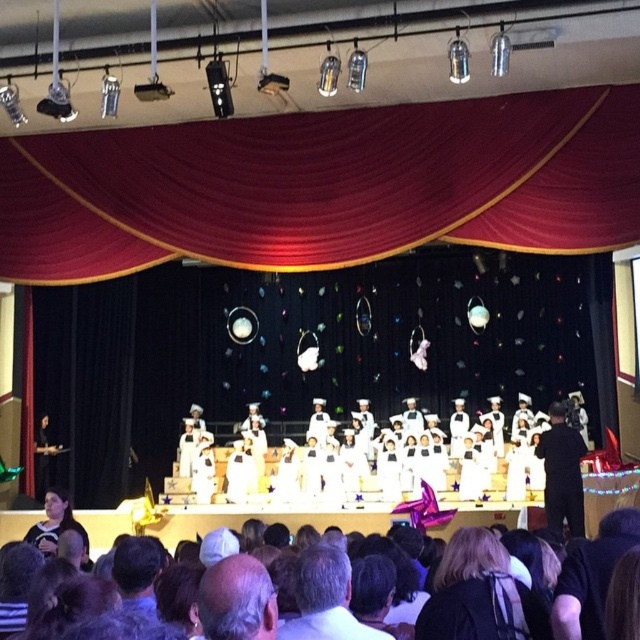
Question: Can you confirm if velvet red curtain at upper center is positioned to the left of white matte uniform at center?

Choices:
 (A) yes
 (B) no

Answer: (A)

Question: Can you confirm if velvet red curtain at upper center is bigger than white matte uniform at center?

Choices:
 (A) yes
 (B) no

Answer: (B)

Question: Considering the real-world distances, which object is farthest from the velvet red curtain at upper center?

Choices:
 (A) dark brown hair at lower center
 (B) white matte uniform at center

Answer: (A)

Question: Which of the following is the farthest from the observer?

Choices:
 (A) (540, 432)
 (B) (300, 554)
 (C) (109, 168)

Answer: (A)

Question: Which of the following is the closest to the observer?

Choices:
 (A) velvet red curtain at upper center
 (B) white matte uniform at center

Answer: (B)

Question: Is white matte uniform at center smaller than dark brown hair at lower center?

Choices:
 (A) no
 (B) yes

Answer: (A)